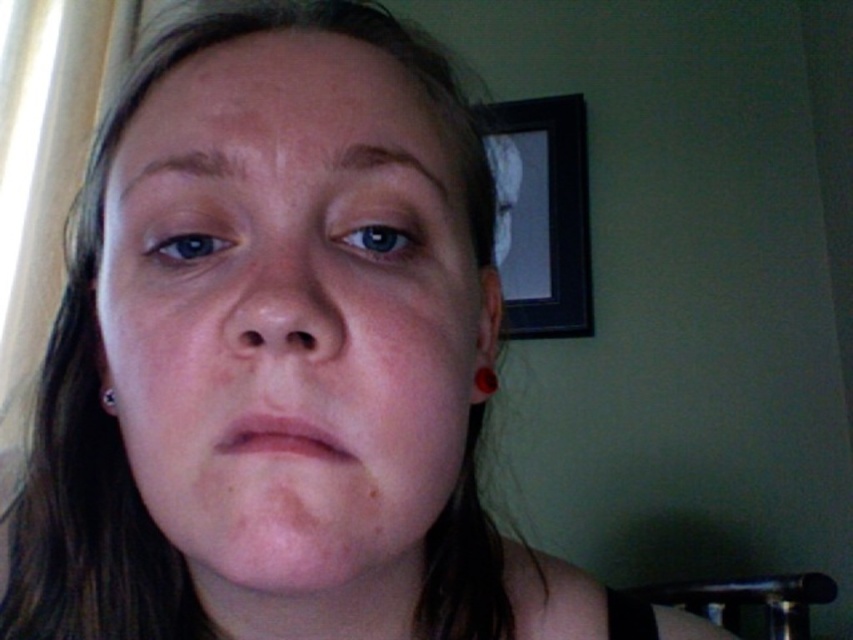
You are a photographer adjusting lighting for a portrait. The subject has a point at coordinates point (291, 314). Where is this point located on the subject?

The point (291, 314) corresponds to the smooth skin face at center.

You are a photographer adjusting lighting for a portrait. The subject has a smooth skin face at center and a silver metallic earring at lower left. Which object is closer to the camera, and why?

The smooth skin face at center is closer to the camera because it is positioned in front of the silver metallic earring at lower left.

Based on the scene description, which object is taller between the smooth skin face at center and the black matte picture frame at upper right?

The black matte picture frame at upper right is taller than the smooth skin face at center.